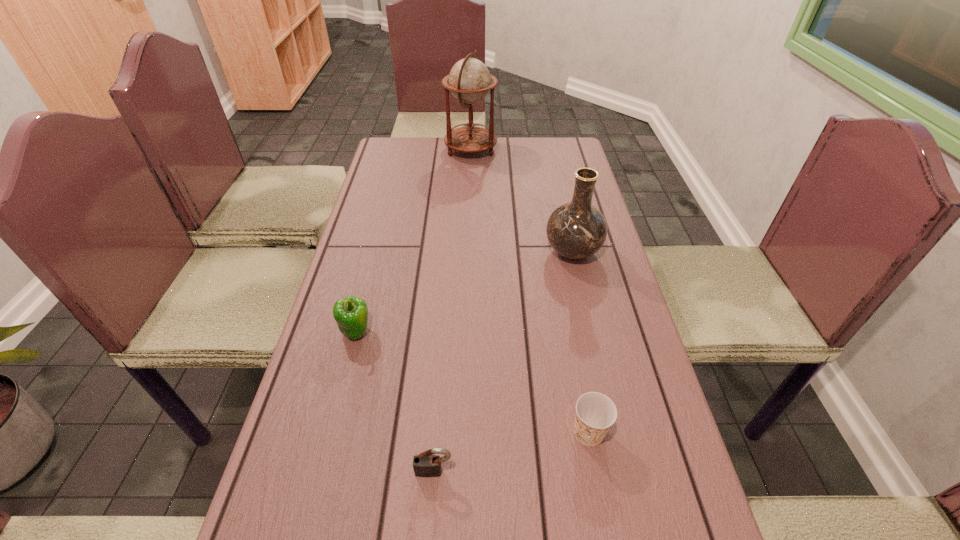
You are a GUI agent. You are given a task and a screenshot of the screen. Output one action in this format:
    pyautogui.click(x=<x>, y=<y>)
    Task: Click on the free space at the far left corner
    The height and width of the screenshot is (540, 960).
    Given the screenshot: What is the action you would take?
    pyautogui.click(x=396, y=157)

In order to click on vacant space that's between the fourth nearest object and the Dixie cup in this screenshot , I will do `click(581, 343)`.

Locate an element on the screen. The width and height of the screenshot is (960, 540). unoccupied area between the farthest object and the padlock is located at coordinates (452, 310).

Identify the location of vacant area between the leftmost object and the vase. The height and width of the screenshot is (540, 960). (464, 292).

The height and width of the screenshot is (540, 960). I want to click on free space between the leftmost object and the globe, so click(414, 240).

Locate an element on the screen. This screenshot has height=540, width=960. free point between the fourth farthest object and the third shortest object is located at coordinates (472, 382).

This screenshot has height=540, width=960. Find the location of `free point between the vase and the third shortest object`. free point between the vase and the third shortest object is located at coordinates (464, 292).

You are a GUI agent. You are given a task and a screenshot of the screen. Output one action in this format:
    pyautogui.click(x=<x>, y=<y>)
    Task: Click on the free space between the padlock and the fourth shortest object
    This screenshot has width=960, height=540.
    Given the screenshot: What is the action you would take?
    pyautogui.click(x=503, y=362)

Where is `vacant area that lies between the vase and the leftmost object`? This screenshot has height=540, width=960. vacant area that lies between the vase and the leftmost object is located at coordinates (464, 292).

At what (x,y) coordinates should I click in order to perform the action: click on empty space between the Dixie cup and the nearest object. Please return your answer as a coordinate pair (x, y). This screenshot has height=540, width=960. Looking at the image, I should click on (512, 453).